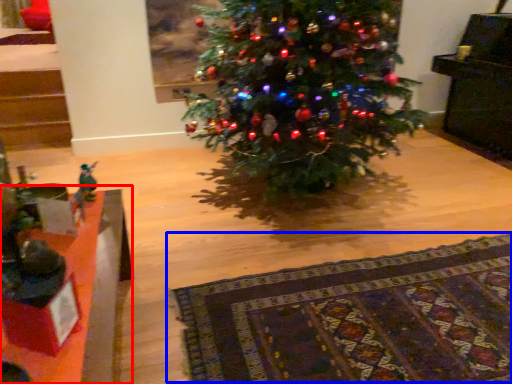
Question: Among these objects, which one is nearest to the camera, table (highlighted by a red box) or blanket (highlighted by a blue box)?

Choices:
 (A) table
 (B) blanket

Answer: (A)